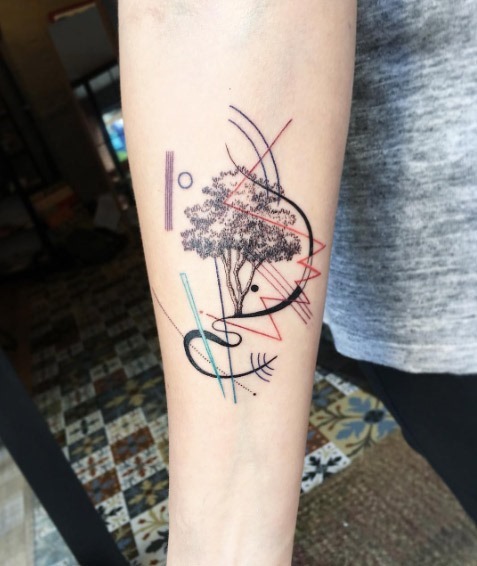
This screenshot has width=477, height=566. I want to click on art deco, so click(x=223, y=342).